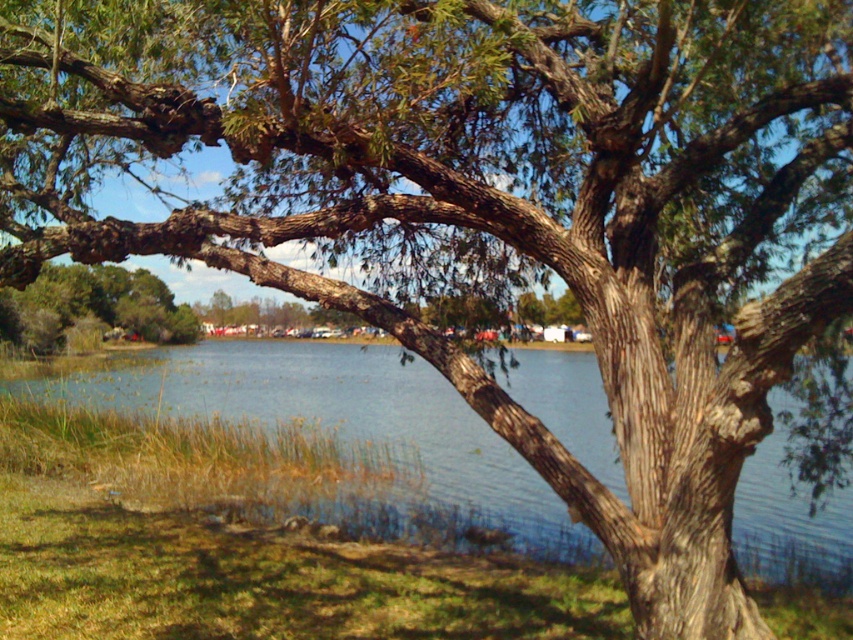
Consider the image. Between clear blue water at center and green leafy tree at lower left, which one has less height?

Standing shorter between the two is clear blue water at center.

Looking at this image, who is more forward, (428, 387) or (25, 317)?

Point (428, 387)

Locate an element on the screen. The height and width of the screenshot is (640, 853). clear blue water at center is located at coordinates (344, 419).